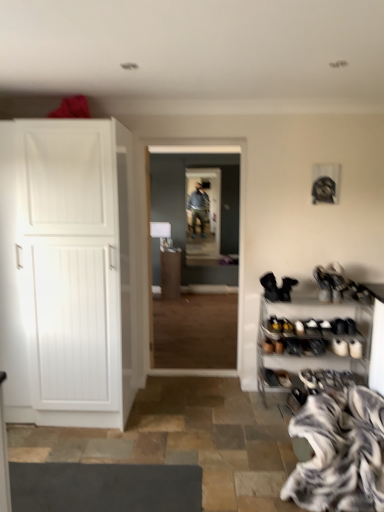
Question: Based on their positions, is zebra print fur at lower right located to the left or right of matte white cabinet at center?

Choices:
 (A) left
 (B) right

Answer: (B)

Question: From a real-world perspective, is zebra print fur at lower right physically located above or below matte white cabinet at center?

Choices:
 (A) below
 (B) above

Answer: (A)

Question: Which object is positioned closest to the metallic silver shoe rack at lower right?

Choices:
 (A) white matte cabinet at left
 (B) matte gray screen door at center
 (C) black suede boot at right, the 1th footwear from the right
 (D) matte white cabinet at center
 (E) black suede boot at lower right, acting as the 2th footwear starting from the right

Answer: (C)

Question: Which object is the closest to the matte white cabinet at center?

Choices:
 (A) zebra print fur at lower right
 (B) white matte cabinet at left
 (C) black suede boot at lower right, the 1th footwear from the left
 (D) matte gray screen door at center
 (E) metallic silver shoe rack at lower right

Answer: (D)